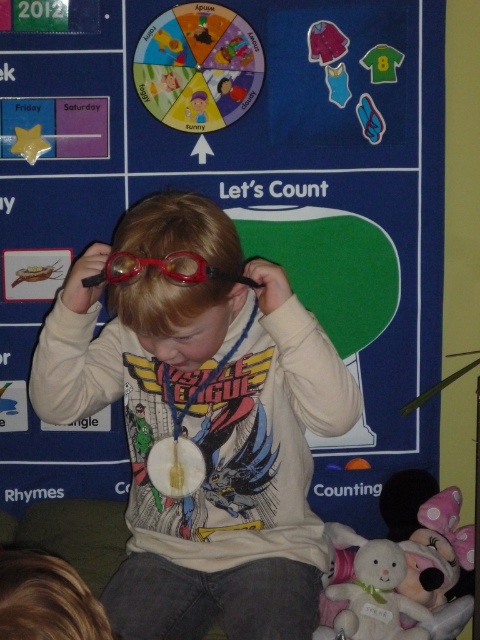
Is matte plastic goggles at center to the left of translucent plastic goggles at center from the viewer's perspective?

In fact, matte plastic goggles at center is to the right of translucent plastic goggles at center.

Who is shorter, matte plastic goggles at center or translucent plastic goggles at center?

Standing shorter between the two is translucent plastic goggles at center.

Find the location of a particular element. matte plastic goggles at center is located at coordinates (203, 420).

At what (x,y) coordinates should I click in order to perform the action: click on matte plastic goggles at center. Please return your answer as a coordinate pair (x, y). This screenshot has height=640, width=480. Looking at the image, I should click on (203, 420).